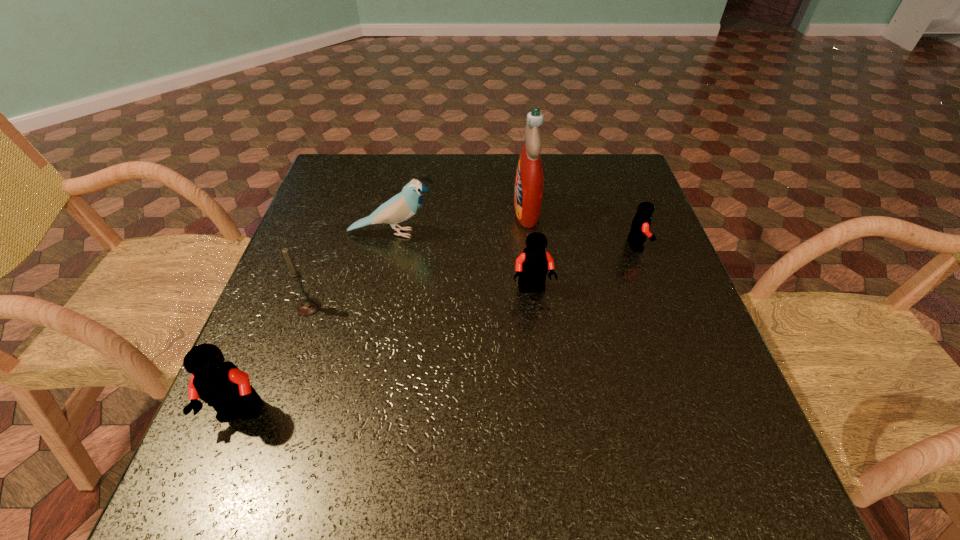
If the aim is uniform spacing by inserting an additional Lego among them, please point to a vacant space for this new Lego. Please provide its 2D coordinates. Your answer should be formatted as a tuple, i.e. [(x, y)], where the tuple contains the x and y coordinates of a point satisfying the conditions above.

[(404, 345)]